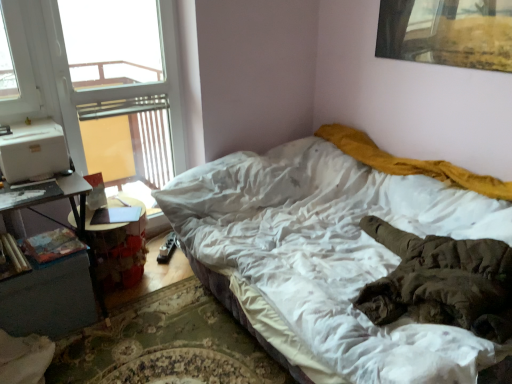
Find the location of a particular element. The height and width of the screenshot is (384, 512). free space above dark gray wood nightstand at lower left (from a real-world perspective) is located at coordinates (35, 255).